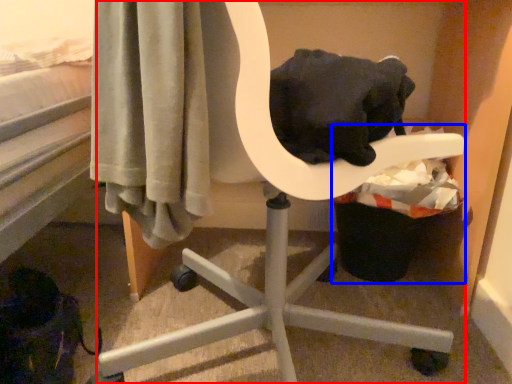
Question: Which object appears farthest to the camera in this image, chair (highlighted by a red box) or laundry basket (highlighted by a blue box)?

Choices:
 (A) chair
 (B) laundry basket

Answer: (B)